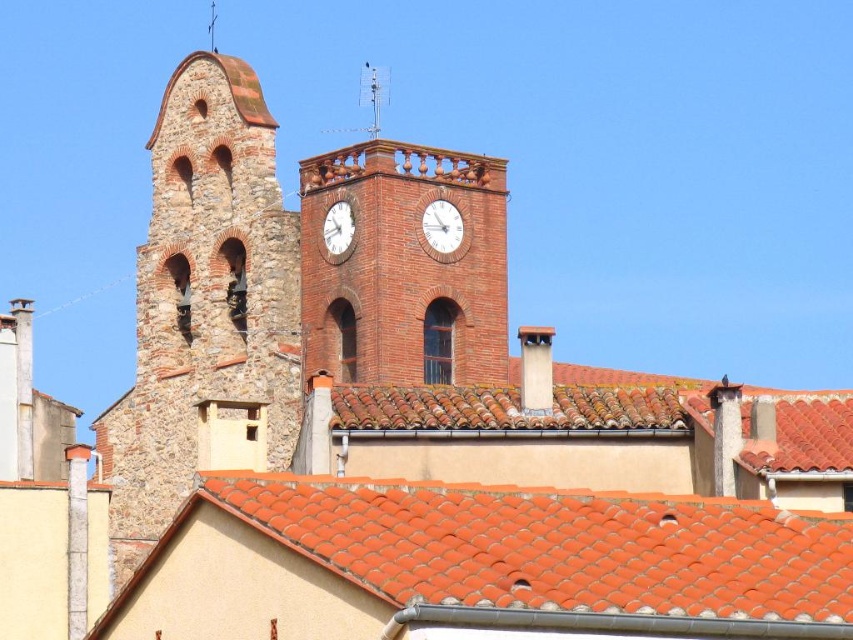
Is orange clay tiles at lower center to the right of brick clock tower at center from the viewer's perspective?

Indeed, orange clay tiles at lower center is positioned on the right side of brick clock tower at center.

What do you see at coordinates (556, 547) in the screenshot?
I see `orange clay tiles at lower center` at bounding box center [556, 547].

Find the location of a particular element. The image size is (853, 640). orange clay tiles at lower center is located at coordinates (x=556, y=547).

Which is in front, point (796, 579) or point (457, 227)?

Point (796, 579)

Is point (734, 536) closer to viewer compared to point (432, 227)?

Yes.

Identify the location of orange clay tiles at lower center. This screenshot has height=640, width=853. (556, 547).

Is orange clay tiles at lower center in front of white matte clock at upper center?

Yes, it is in front of white matte clock at upper center.

Can you confirm if orange clay tiles at lower center is taller than white matte clock at upper center?

Yes.

Is point (675, 497) in front of point (335, 234)?

Yes, point (675, 497) is in front of point (335, 234).

The height and width of the screenshot is (640, 853). I want to click on orange clay tiles at lower center, so click(556, 547).